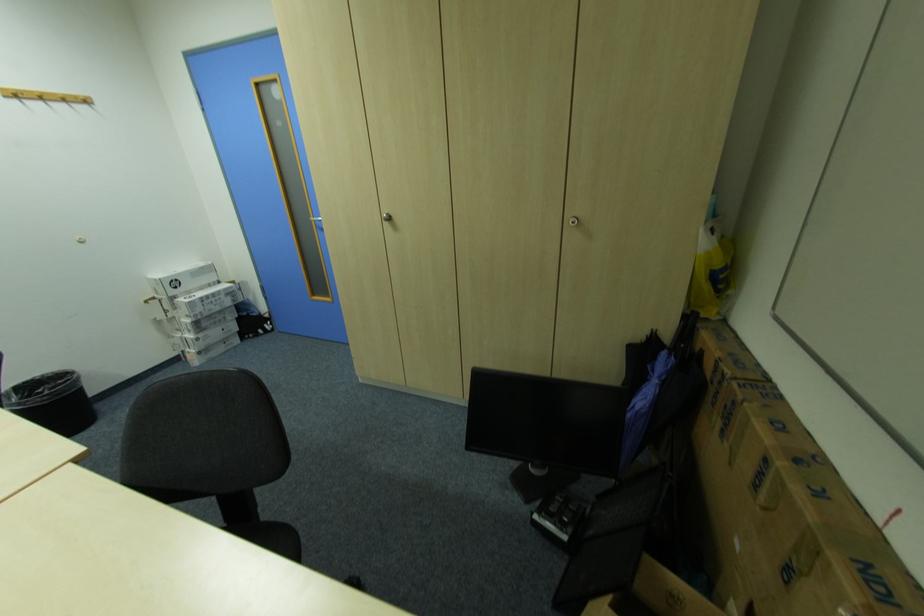
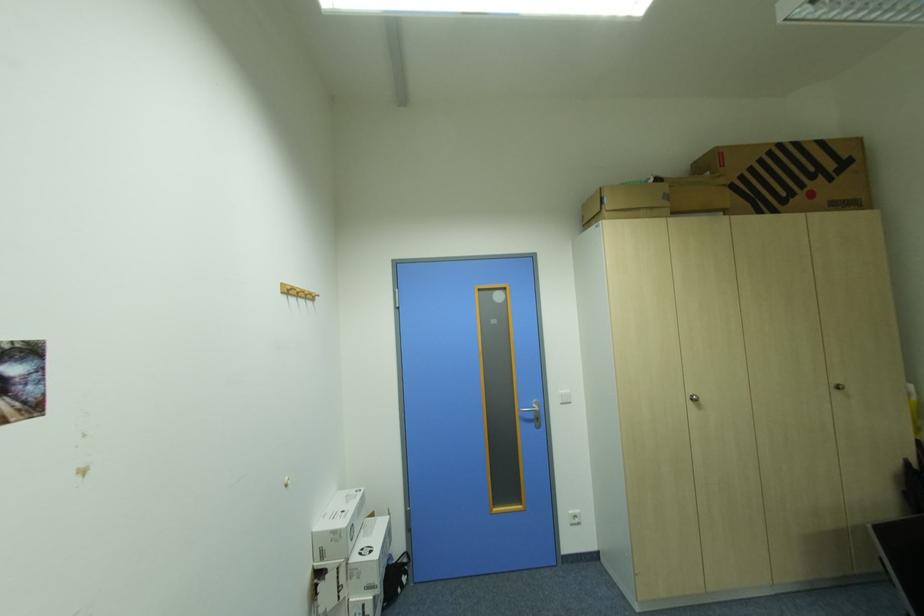
The point at (196,317) is marked in the first image. Where is the corresponding point in the second image?

(377, 590)